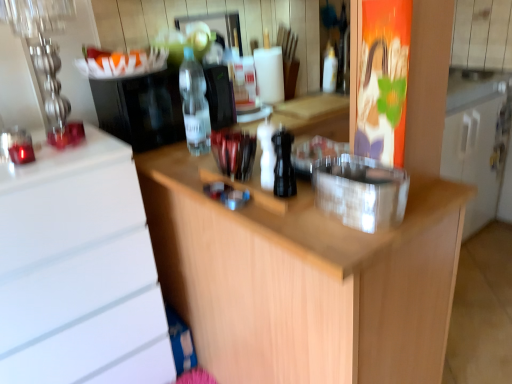
Where is `vacant area that is in front of transparent plastic bottle at center, positioned as the third bottle in right-to-left order`? The width and height of the screenshot is (512, 384). vacant area that is in front of transparent plastic bottle at center, positioned as the third bottle in right-to-left order is located at coordinates (183, 164).